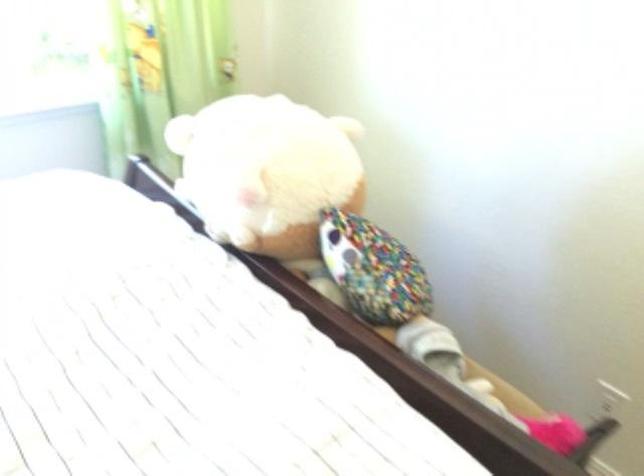
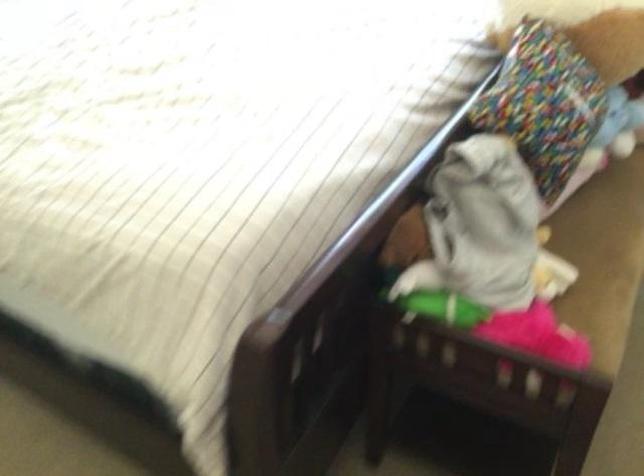
Locate, in the second image, the point that corresponds to [265,279] in the first image.

(468, 76)